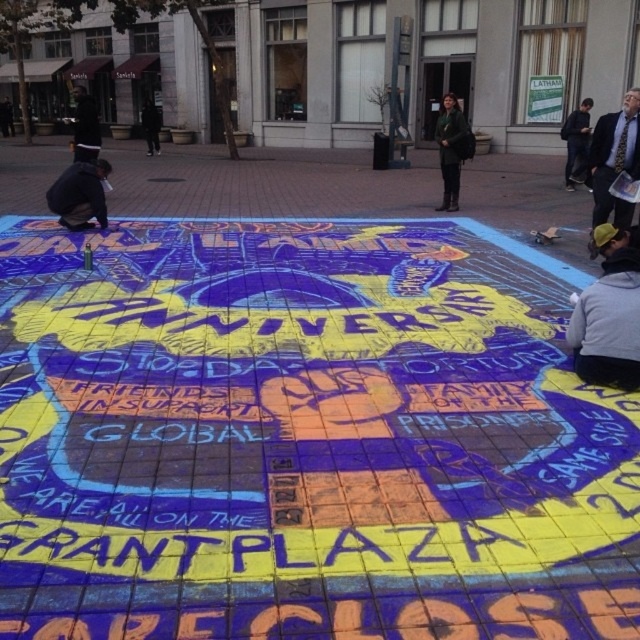
Question: Does light blue shirt at upper right have a smaller size compared to dark blue jacket at left?

Choices:
 (A) no
 (B) yes

Answer: (B)

Question: Where is light blue shirt at upper right located in relation to dark blue jacket at left in the image?

Choices:
 (A) left
 (B) right

Answer: (B)

Question: Which of these objects is positioned closest to the dark blue shirt at upper left?

Choices:
 (A) dark green jacket at center
 (B) dark blue jeans at lower right
 (C) gray sweatshirt at lower right
 (D) light blue shirt at upper right

Answer: (A)

Question: Is light blue shirt at upper right closer to camera compared to dark blue jeans at lower right?

Choices:
 (A) yes
 (B) no

Answer: (A)

Question: Among these points, which one is farthest from the camera?

Choices:
 (A) (628, 310)
 (B) (572, 180)
 (C) (621, 131)
 (D) (80, 170)

Answer: (B)

Question: Considering the real-world distances, which object is closest to the light blue shirt at upper right?

Choices:
 (A) dark green jacket at center
 (B) gray sweatshirt at lower right
 (C) dark blue jacket at left
 (D) dark blue jeans at lower right

Answer: (B)